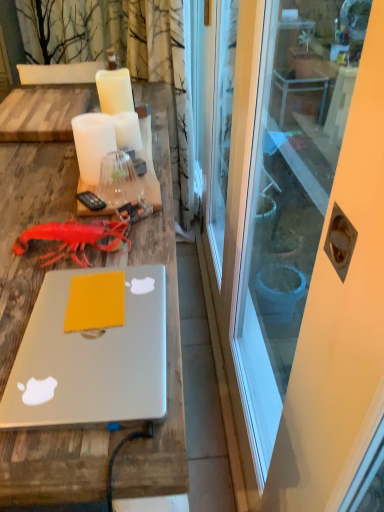
Question: Is yellow matte notepad at center inside or outside of white matte candle at center, acting as the second candle starting from the back?

Choices:
 (A) outside
 (B) inside

Answer: (A)

Question: Is yellow matte notepad at center wider or thinner than white matte candle at center, which appears as the 2th candle when viewed from the front?

Choices:
 (A) thin
 (B) wide

Answer: (A)

Question: Estimate the real-world distances between objects in this image. Which object is closer to the white matte candle at center, acting as the second candle starting from the back?

Choices:
 (A) white glossy screen door at center
 (B) silver metallic laptop at center
 (C) white matte candle at upper center, the 1th candle when ordered from front to back
 (D) white matte candle at center, acting as the first candle starting from the back
 (E) yellow matte notepad at center

Answer: (D)

Question: Which is nearer to the silver metallic laptop at center?

Choices:
 (A) yellow matte notepad at center
 (B) rubber matte lobster at center
 (C) white glossy screen door at center
 (D) white matte candle at upper center, the 1th candle when ordered from front to back
 (E) white matte candle at center, marked as the third candle in a front-to-back arrangement

Answer: (A)